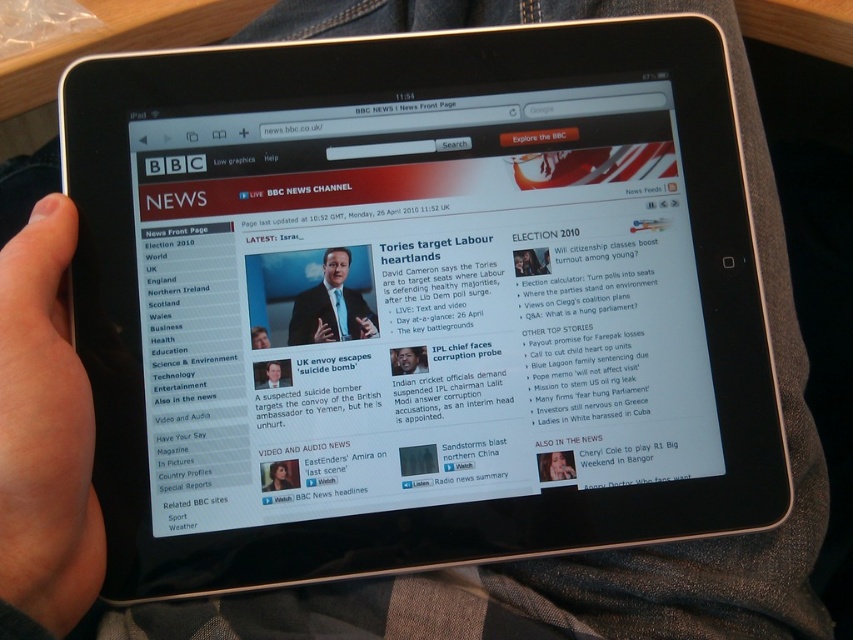
Question: Estimate the real-world distances between objects in this image. Which object is farther from the skinsmoothhand at left?

Choices:
 (A) smooth skin face at lower center
 (B) matte black suit at center

Answer: (A)

Question: Which is nearer to the matte black suit at center?

Choices:
 (A) smooth skin face at lower left
 (B) skinsmoothhand at left

Answer: (A)

Question: Is skinsmoothhand at left positioned behind smooth skin face at lower left?

Choices:
 (A) yes
 (B) no

Answer: (B)

Question: Can you confirm if matte black suit at center is bigger than smooth skin face at lower center?

Choices:
 (A) no
 (B) yes

Answer: (B)

Question: Is matte black suit at center wider than smooth skin face at lower center?

Choices:
 (A) yes
 (B) no

Answer: (A)

Question: Which is farther from the smooth skin face at lower left?

Choices:
 (A) matte black suit at center
 (B) skinsmoothhand at left
 (C) smooth skin face at lower center

Answer: (C)